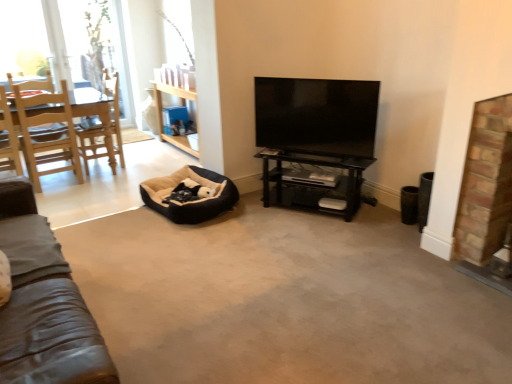
Question: From the image's perspective, is wooden chair at left, the 1th chair positioned from the right, located above or below light wood chair at left, the 2th chair when ordered from right to left?

Choices:
 (A) above
 (B) below

Answer: (A)

Question: Relative to light wood chair at left, the 2th chair when ordered from right to left, is wooden chair at left, the 1th chair positioned from the right, in front or behind?

Choices:
 (A) front
 (B) behind

Answer: (B)

Question: Considering the real-world distances, which object is farthest from the light wood chair at left, which is the first chair in left-to-right order?

Choices:
 (A) wooden chair at left, the 1th chair positioned from the right
 (B) flat screen tv at center
 (C) beige plush bean bag at center
 (D) black glossy shelf at center
 (E) brick fireplace at right

Answer: (E)

Question: Which is farther from the black glossy shelf at center?

Choices:
 (A) beige plush bean bag at center
 (B) wooden chair at left, the second chair positioned from the left
 (C) brick fireplace at right
 (D) flat screen tv at center
 (E) light wood chair at left, which is the first chair in left-to-right order

Answer: (E)